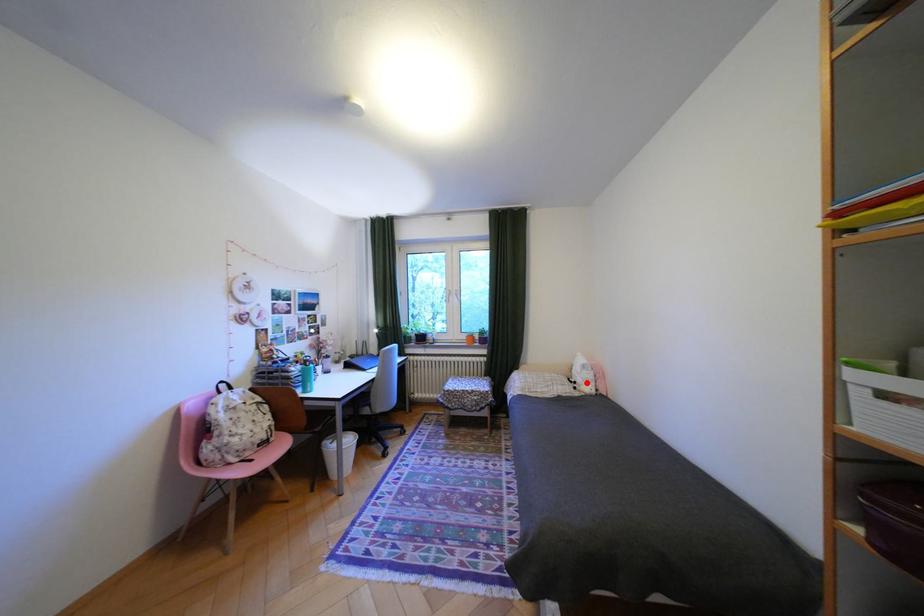
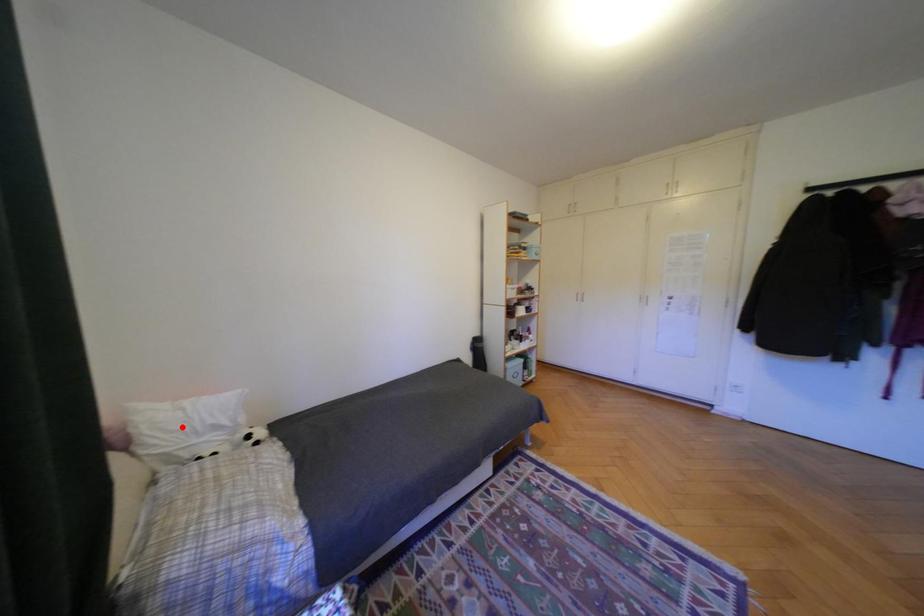
I am providing you with two images of the same scene from different viewpoints. A red point is marked on the first image and another point is marked on the second image. Is the marked point in image1 the same physical position as the marked point in image2?

No